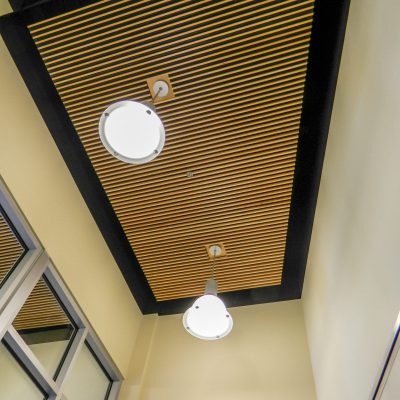
You are a GUI agent. You are given a task and a screenshot of the screen. Output one action in this format:
    pyautogui.click(x=<x>, y=<y>)
    Task: Click on the wall
    The height and width of the screenshot is (400, 400).
    Given the screenshot: What is the action you would take?
    pyautogui.click(x=211, y=361), pyautogui.click(x=106, y=312), pyautogui.click(x=378, y=260)